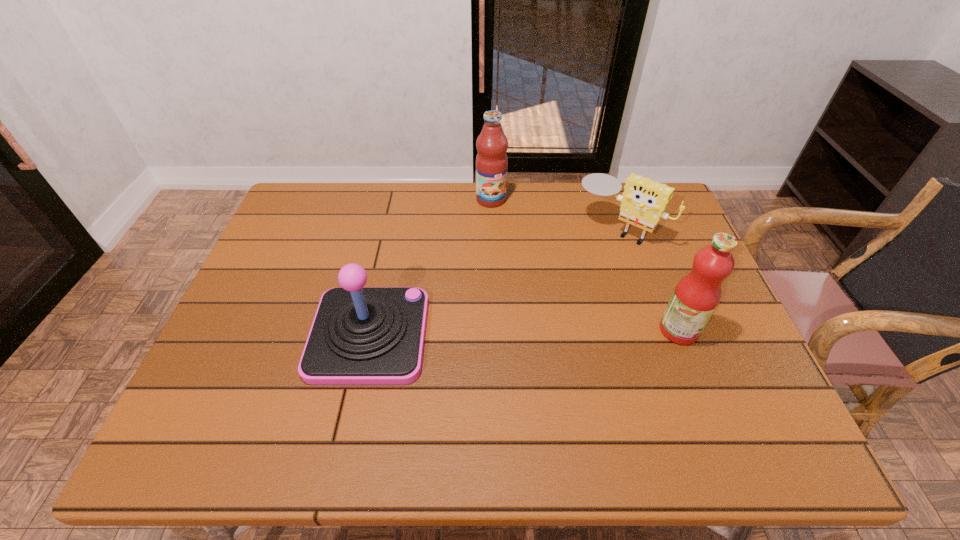
Where is `the leftmost object`? The image size is (960, 540). the leftmost object is located at coordinates (360, 335).

At what (x,y) coordinates should I click in order to perform the action: click on joystick. Please return your answer as a coordinate pair (x, y). Looking at the image, I should click on (360, 335).

Identify the location of the right fruit juice. This screenshot has height=540, width=960. (696, 296).

The image size is (960, 540). I want to click on the shortest object, so click(643, 202).

You are a GUI agent. You are given a task and a screenshot of the screen. Output one action in this format:
    pyautogui.click(x=<x>, y=<y>)
    Task: Click on the left fruit juice
    
    Given the screenshot: What is the action you would take?
    pyautogui.click(x=491, y=161)

Identify the location of the second object from left to right. (491, 161).

Image resolution: width=960 pixels, height=540 pixels. What are the coordinates of `blank space located 0.180m forward from the base of the joystick` in the screenshot? It's located at (500, 335).

You are a GUI agent. You are given a task and a screenshot of the screen. Output one action in this format:
    pyautogui.click(x=<x>, y=<y>)
    Task: Click on the free region located 0.090m on the front label of the nearer fruit juice
    
    Given the screenshot: What is the action you would take?
    pyautogui.click(x=735, y=330)

This screenshot has height=540, width=960. What are the coordinates of `free location located on the front-facing side of the sponge` in the screenshot? It's located at (573, 276).

You are a GUI agent. You are given a task and a screenshot of the screen. Output one action in this format:
    pyautogui.click(x=<x>, y=<y>)
    Task: Click on the blank space located on the front-facing side of the sponge
    
    Given the screenshot: What is the action you would take?
    pyautogui.click(x=565, y=285)